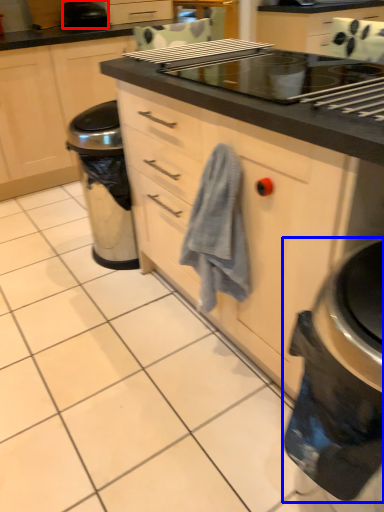
Question: Among these objects, which one is farthest to the camera, kitchen appliance (highlighted by a red box) or home appliance (highlighted by a blue box)?

Choices:
 (A) kitchen appliance
 (B) home appliance

Answer: (A)